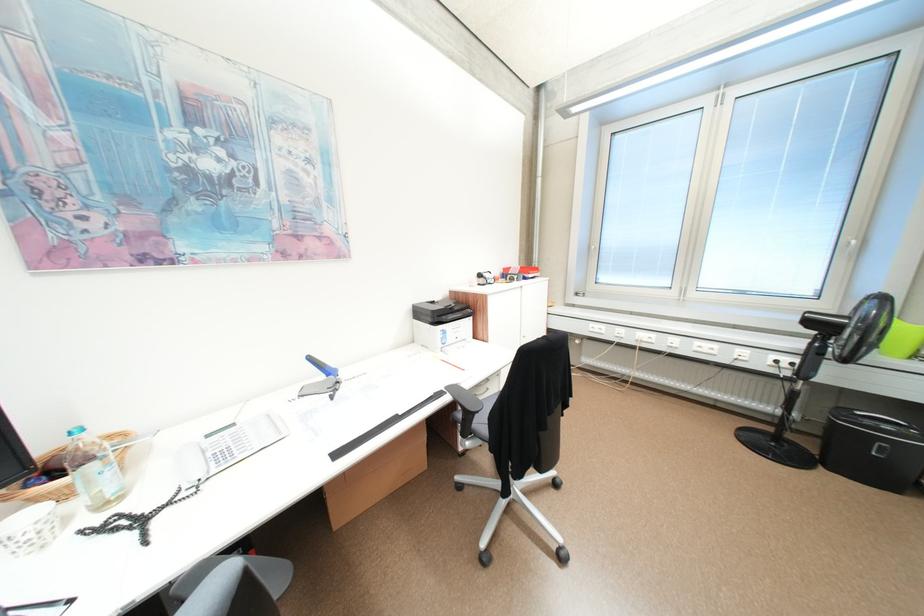
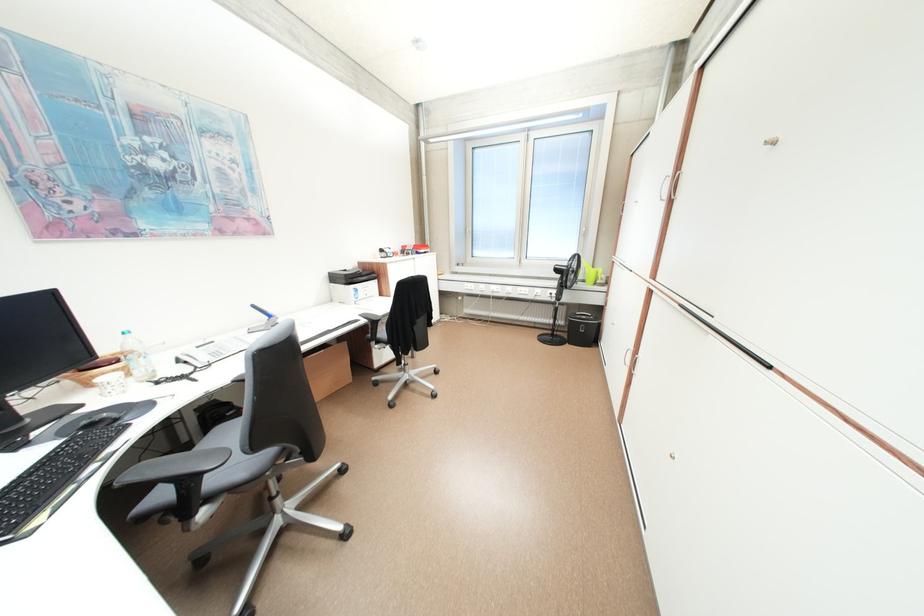
The point at (819, 447) is marked in the first image. Where is the corresponding point in the second image?

(576, 337)